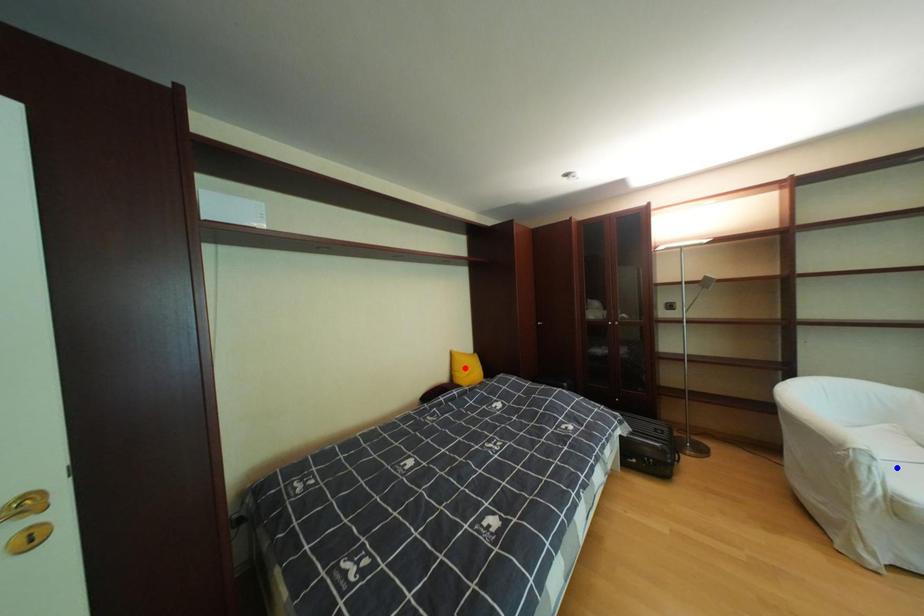
Question: In the image, two points are highlighted. Which point is nearer to the camera? Reply with the corresponding letter.

Choices:
 (A) blue point
 (B) red point

Answer: (A)